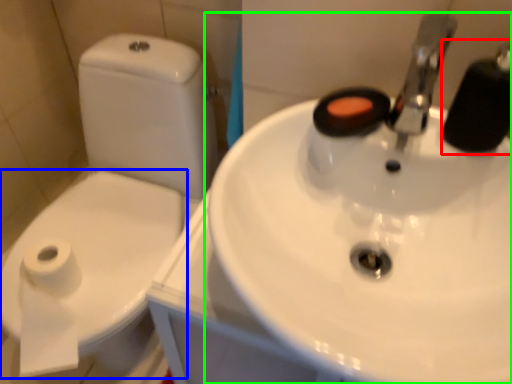
Question: Which is nearer to the plumbing fixture (highlighted by a red box)? bidet (highlighted by a blue box) or sink (highlighted by a green box).

Choices:
 (A) bidet
 (B) sink

Answer: (B)